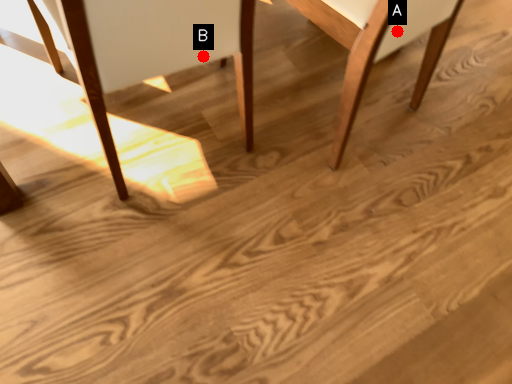
Question: Two points are circled on the image, labeled by A and B beside each circle. Among these points, which one is nearest to the camera?

Choices:
 (A) A is closer
 (B) B is closer

Answer: (B)